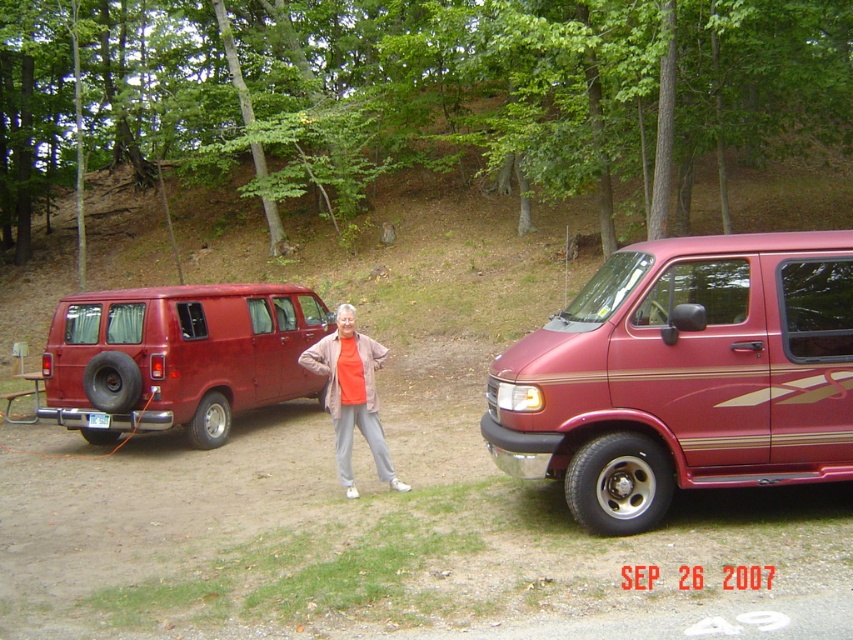
Question: Estimate the real-world distances between objects in this image. Which object is farther from the shiny maroon van at center?

Choices:
 (A) orange fabric jacket at center
 (B) matte red van at left

Answer: (B)

Question: Which point is closer to the camera taking this photo?

Choices:
 (A) (160, 307)
 (B) (585, 504)
 (C) (370, 381)

Answer: (B)

Question: Can you confirm if shiny maroon van at center is positioned to the left of matte red van at left?

Choices:
 (A) yes
 (B) no

Answer: (B)

Question: Can you confirm if shiny maroon van at center is positioned below orange fabric jacket at center?

Choices:
 (A) yes
 (B) no

Answer: (B)

Question: Estimate the real-world distances between objects in this image. Which object is closer to the shiny maroon van at center?

Choices:
 (A) matte red van at left
 (B) orange fabric jacket at center

Answer: (B)

Question: Is matte red van at left to the right of orange fabric jacket at center from the viewer's perspective?

Choices:
 (A) no
 (B) yes

Answer: (A)